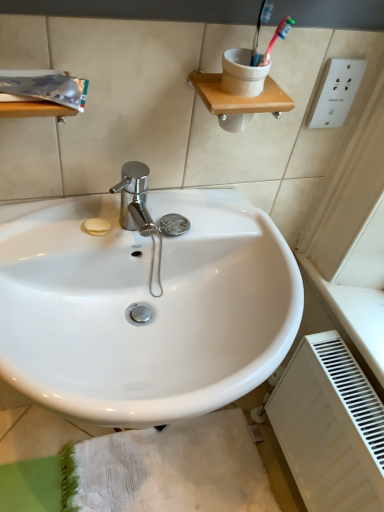
Find the location of a particular element. Image resolution: width=384 pixels, height=512 pixels. vacant space situated above white matte radiator at lower right (from a real-world perspective) is located at coordinates (349, 385).